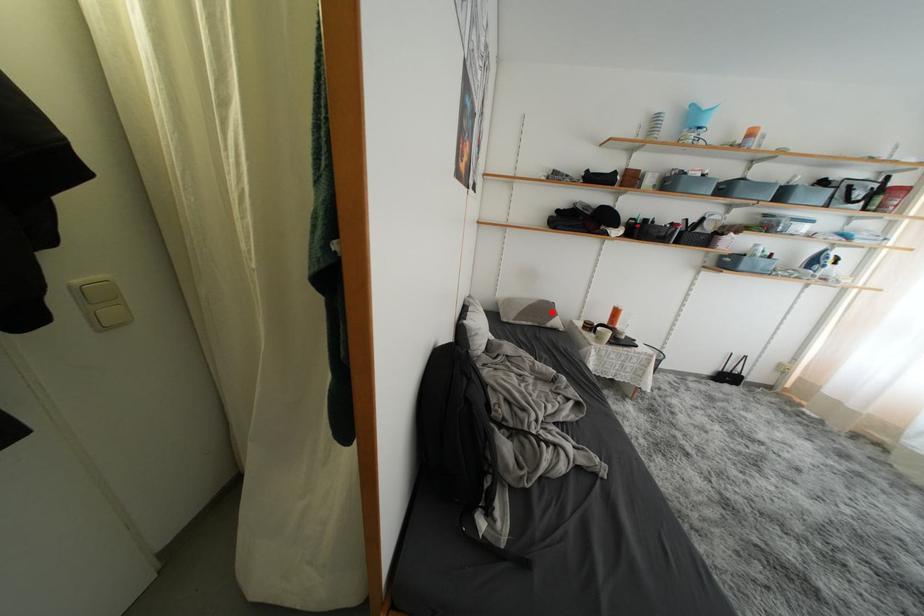
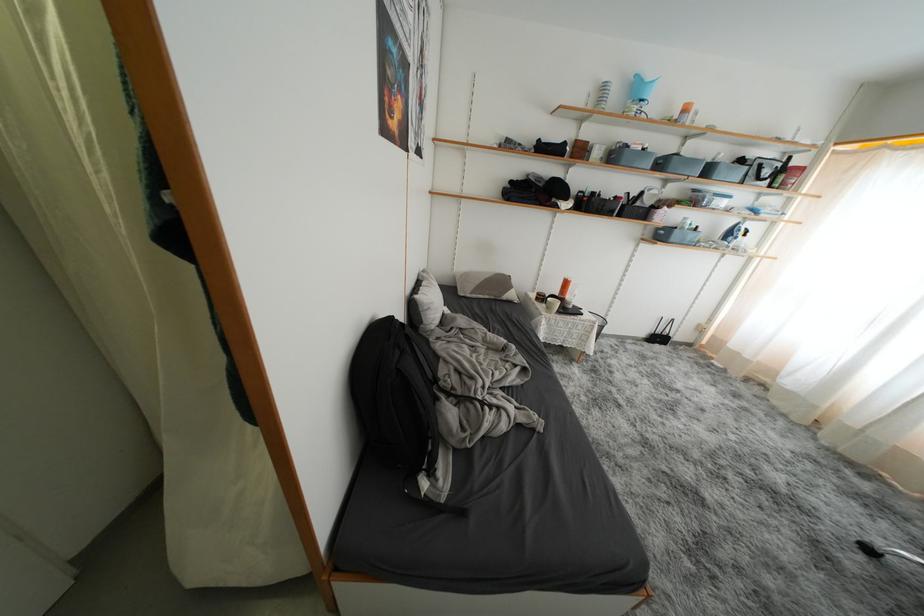
Locate, in the second image, the point that corresponds to the highlighted location in the first image.

(508, 286)